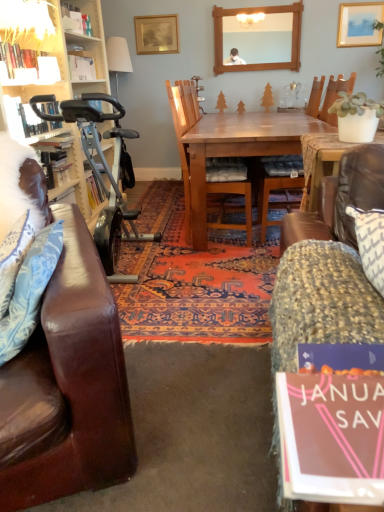
At what (x,y) coordinates should I click in order to perform the action: click on vacant space in front of silver metallic exercise bike at left. Please return your answer as a coordinate pair (x, y). This screenshot has width=384, height=512. Looking at the image, I should click on click(173, 316).